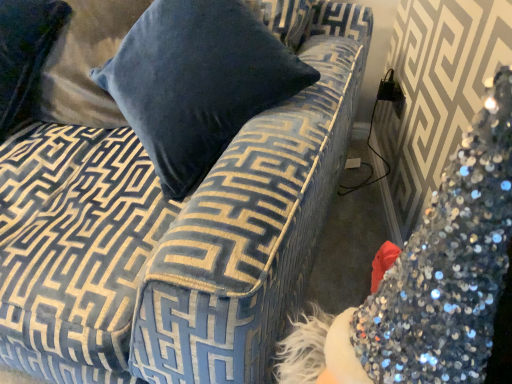
Question: From a real-world perspective, relative to velvet blue couch at upper left, is velvet blue pillow at upper left vertically above or below?

Choices:
 (A) below
 (B) above

Answer: (B)

Question: In the image, is velvet blue pillow at upper left on the left side or the right side of velvet blue couch at upper left?

Choices:
 (A) left
 (B) right

Answer: (A)

Question: From their relative heights in the image, would you say velvet blue pillow at upper left is taller or shorter than velvet blue couch at upper left?

Choices:
 (A) tall
 (B) short

Answer: (B)

Question: Choose the correct answer: Is velvet blue couch at upper left inside velvet blue pillow at upper left or outside it?

Choices:
 (A) inside
 (B) outside

Answer: (B)

Question: From the image's perspective, is velvet blue couch at upper left located above or below velvet blue pillow at upper left?

Choices:
 (A) above
 (B) below

Answer: (B)

Question: From a real-world perspective, is velvet blue couch at upper left above or below velvet blue pillow at upper left?

Choices:
 (A) above
 (B) below

Answer: (B)

Question: Is point [x=16, y=279] positioned closer to the camera than point [x=23, y=104]?

Choices:
 (A) farther
 (B) closer

Answer: (B)